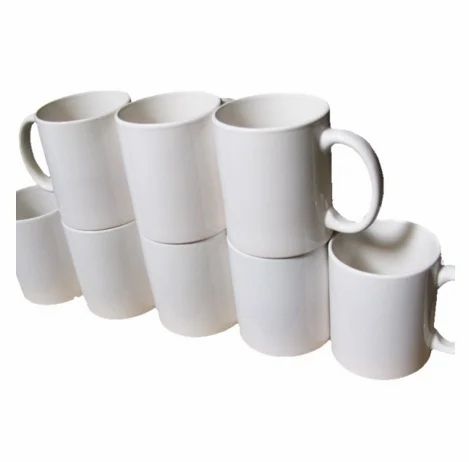
What are the coordinates of `mugs` in the screenshot? It's located at (30, 260), (93, 267), (172, 283), (258, 291), (390, 305), (295, 192), (79, 185), (182, 129).